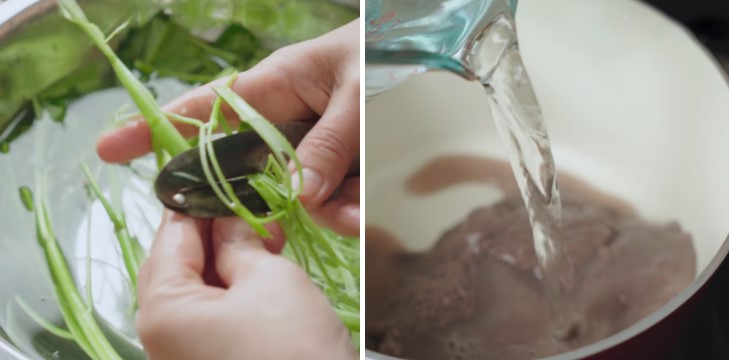
At what (x,y) coordinates should I click in order to perform the action: click on glass. Please return your answer as a coordinate pair (x, y). This screenshot has height=360, width=729. Looking at the image, I should click on (407, 37).